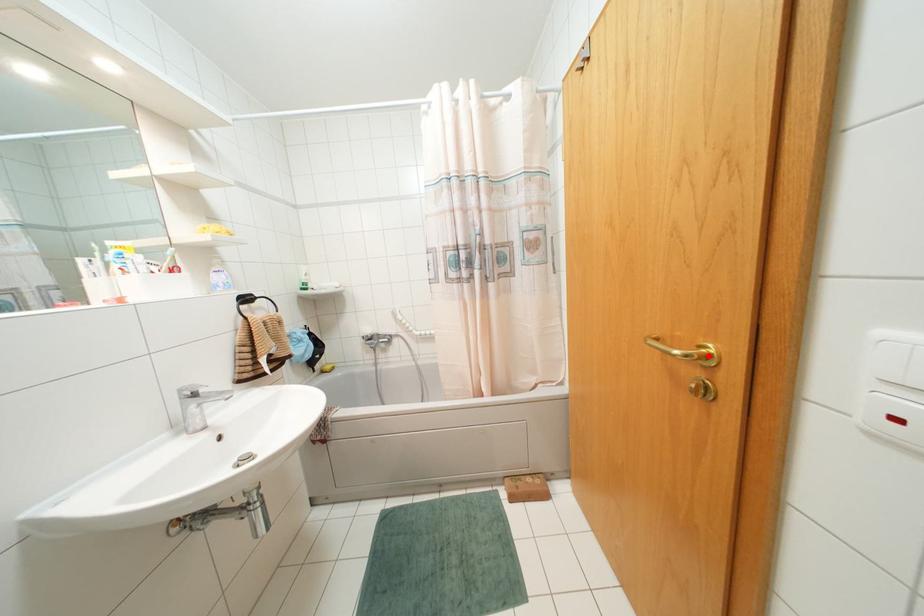
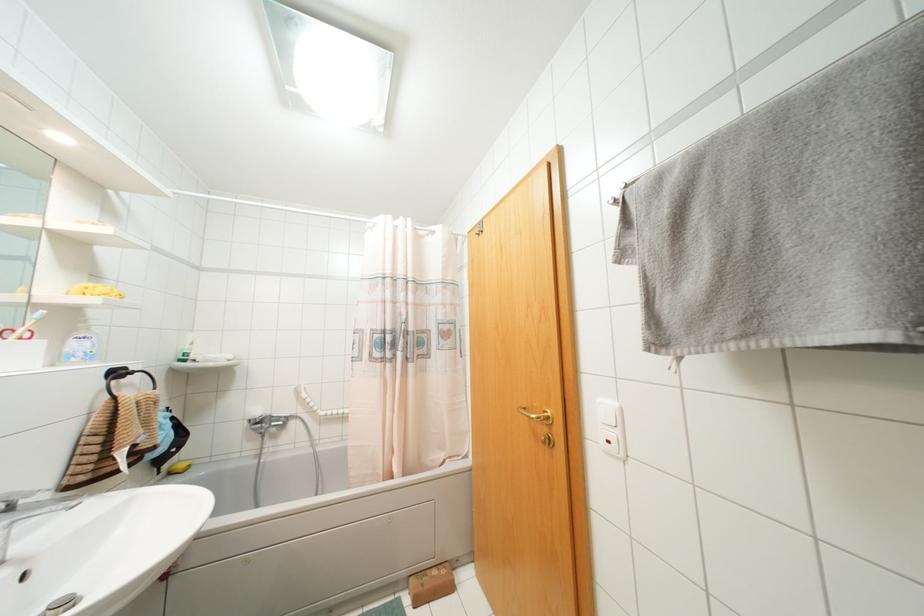
In the second image, find the point that corresponds to the highlighted location in the first image.

(546, 416)